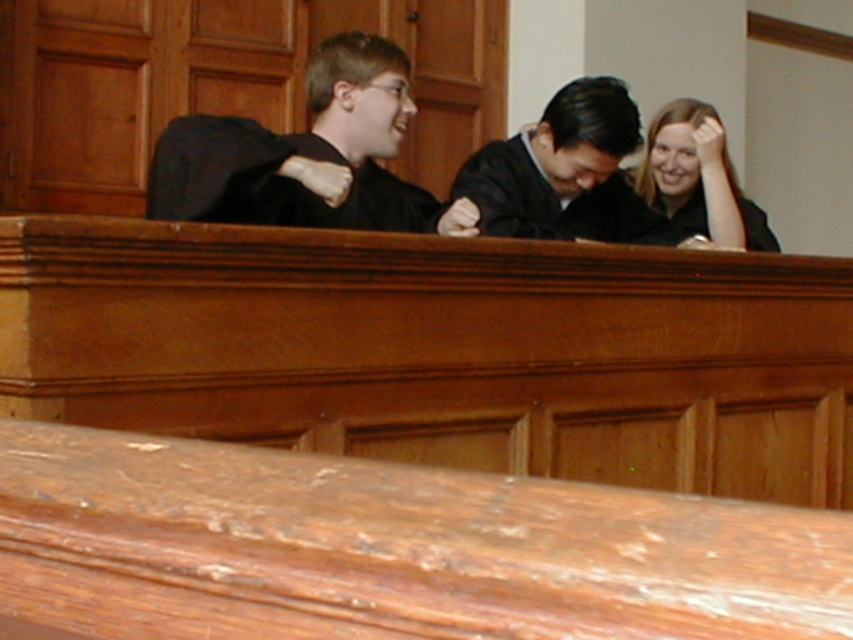
Who is more forward, (364, 116) or (489, 179)?

Positioned in front is point (364, 116).

Is point (338, 35) behind point (595, 115)?

No.

Where is `black matte/black suit at left`? black matte/black suit at left is located at coordinates (308, 156).

Is point (292, 179) in front of point (666, 193)?

Yes, it is in front of point (666, 193).

Is black matte robe at left wider than matte black shirt at upper right?

Yes.

Which is behind, point (311, 204) or point (727, 172)?

The point (727, 172) is behind.

Where is `black matte robe at left`? The width and height of the screenshot is (853, 640). black matte robe at left is located at coordinates (305, 188).

Between point (422, 214) and point (753, 240), which one is positioned in front?

Positioned in front is point (422, 214).

Between black matte/black suit at left and matte black shirt at upper right, which one is positioned lower?

black matte/black suit at left is lower down.

Does point (397, 74) come in front of point (689, 104)?

Yes, point (397, 74) is in front of point (689, 104).

The height and width of the screenshot is (640, 853). I want to click on black matte/black suit at left, so click(308, 156).